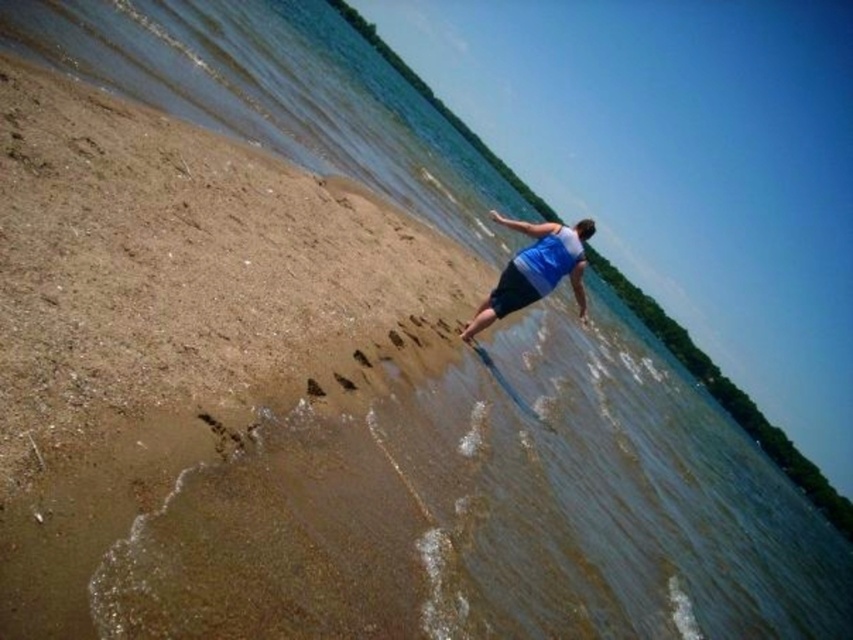
Question: Which point is closer to the camera?

Choices:
 (A) (357, 388)
 (B) (315, 396)
 (C) (563, 225)

Answer: (B)

Question: Does blue fabric man at center lie in front of brown sand at lower center?

Choices:
 (A) no
 (B) yes

Answer: (A)

Question: Among these objects, which one is nearest to the camera?

Choices:
 (A) brown sand at lower center
 (B) brown sand at center
 (C) blue fabric man at center
 (D) blue fabric shorts at center

Answer: (B)

Question: Can you confirm if blue fabric shorts at center is positioned to the right of brown sand at lower center?

Choices:
 (A) yes
 (B) no

Answer: (A)

Question: Does blue fabric man at center come behind brown sand at lower center?

Choices:
 (A) yes
 (B) no

Answer: (A)

Question: Which point is farther from the camera taking this photo?

Choices:
 (A) (312, 378)
 (B) (509, 275)
 (C) (512, 260)

Answer: (C)